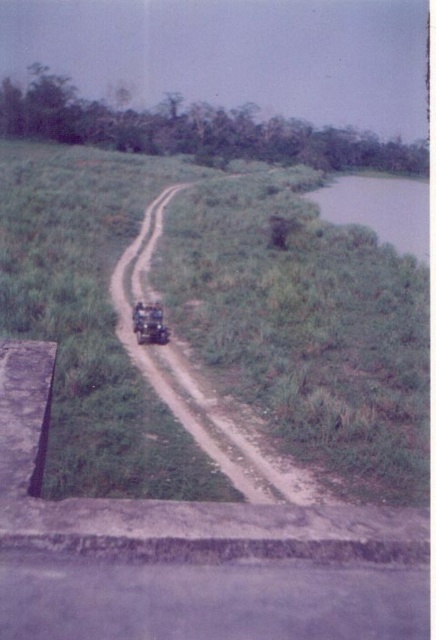
Can you confirm if brown dirt track at center is positioned to the right of metallic matte jeep at center?

Incorrect, brown dirt track at center is not on the right side of metallic matte jeep at center.

Can you confirm if brown dirt track at center is positioned below metallic matte jeep at center?

No.

Between point (169, 378) and point (164, 330), which one is positioned behind?

Point (164, 330)

This screenshot has width=436, height=640. Find the location of `brown dirt track at center`. brown dirt track at center is located at coordinates (203, 387).